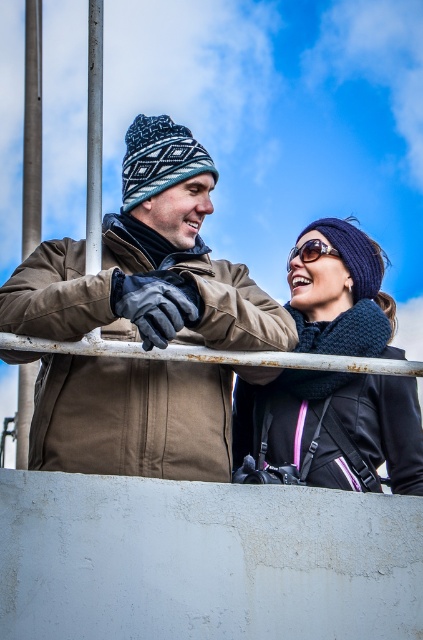
You are a photographer trying to capture a closeup of the knitted dark blue scarf at upper right and the sunglasses at center. Which object should you focus on first to ensure both are in focus?

The knitted dark blue scarf at upper right is in front of the sunglasses at center, so you should focus on the knitted dark blue scarf at upper right first to ensure both are in focus.

You are a painter who needs to paint both the smooth silver pole at left and the smooth metal pole at upper left. Which pole requires more ladder height to reach its top?

The smooth silver pole at left is much taller than the smooth metal pole at upper left, so you will need a taller ladder to reach the top of the smooth silver pole at left.

You are standing between the smooth silver pole at left and the smooth metal pole at upper left. Which pole is closer to your left side?

The smooth silver pole at left is closer to your left side because it is positioned to the left of the smooth metal pole at upper left.